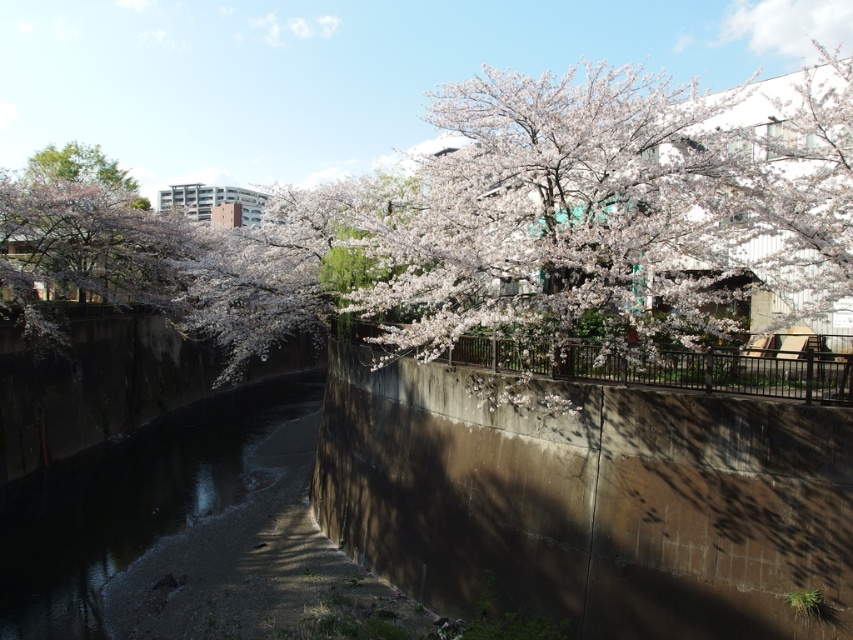
In the scene shown: Can you confirm if white blossoms at upper center is smaller than pink blossoms at left?

Actually, white blossoms at upper center might be larger than pink blossoms at left.

Does point (718, 276) lie behind point (114, 164)?

No, it is in front of (114, 164).

At what (x,y) coordinates should I click in order to perform the action: click on white blossoms at upper center. Please return your answer as a coordinate pair (x, y). The image size is (853, 640). Looking at the image, I should click on (466, 230).

How distant is dark concrete river at center from pink blossoms at left?

They are 28.91 meters apart.

Is point (149, 531) more distant than point (73, 180)?

No, (149, 531) is in front of (73, 180).

Where is `dark concrete river at center`? This screenshot has width=853, height=640. dark concrete river at center is located at coordinates (131, 502).

Can you confirm if white blossoms at upper center is positioned below dark concrete river at center?

No.

Is point (389, 333) positioned behind point (9, 515)?

No, it is in front of (9, 515).

The image size is (853, 640). In order to click on white blossoms at upper center in this screenshot , I will do `click(466, 230)`.

Find the location of `white blossoms at upper center`. white blossoms at upper center is located at coordinates point(466,230).